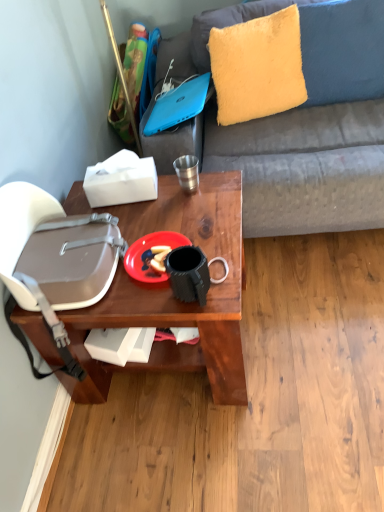
In order to click on free space behind plastic matte plate at center in this screenshot , I will do `click(158, 216)`.